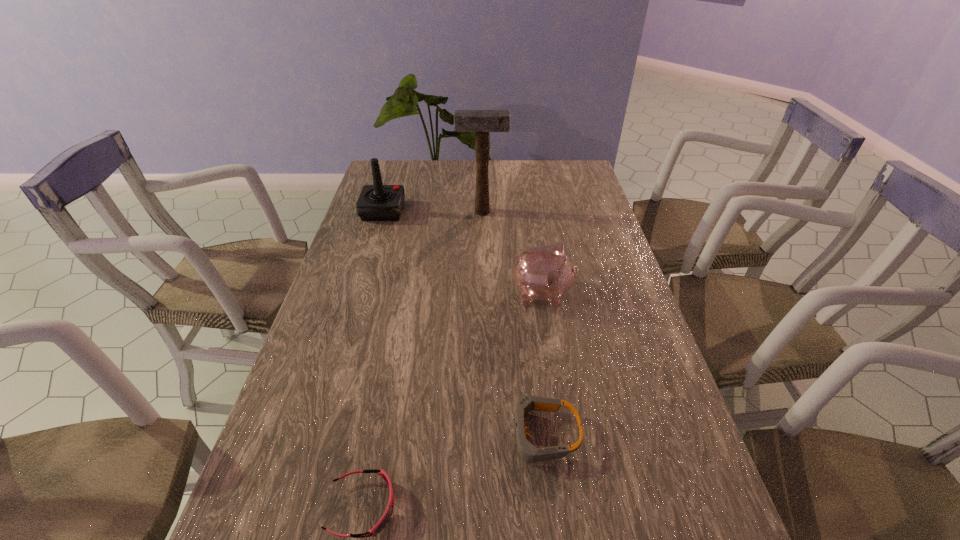
The height and width of the screenshot is (540, 960). I want to click on vacant space situated on the front and back of the right goggles, so click(435, 434).

Locate an element on the screen. blank space located on the front and back of the right goggles is located at coordinates (444, 434).

Identify the location of object that is at the left edge. (377, 202).

This screenshot has width=960, height=540. In the image, there is a desktop. In order to click on vacant space at the far edge in this screenshot , I will do `click(512, 184)`.

Identify the location of free space at the left edge of the desktop. Image resolution: width=960 pixels, height=540 pixels. (310, 411).

In the image, there is a desktop. At what (x,y) coordinates should I click in order to perform the action: click on free space at the right edge. Please return your answer as a coordinate pair (x, y). Looking at the image, I should click on (638, 308).

The width and height of the screenshot is (960, 540). I want to click on vacant point located between the third shortest object and the second tallest object, so click(463, 252).

In order to click on vacant space in between the third tallest object and the mallet in this screenshot , I will do `click(512, 253)`.

I want to click on empty space between the farther goggles and the third shortest object, so click(x=542, y=364).

Find the location of a particular element. This screenshot has width=960, height=540. free space between the farther goggles and the piggy bank is located at coordinates (542, 364).